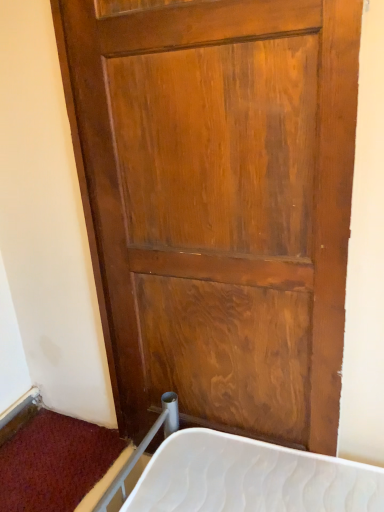
What is the approximate height of glossy wood door at center?

glossy wood door at center is 4.53 feet in height.

Describe the element at coordinates (218, 203) in the screenshot. The width and height of the screenshot is (384, 512). I see `glossy wood door at center` at that location.

Where is `glossy wood door at center`? The width and height of the screenshot is (384, 512). glossy wood door at center is located at coordinates (218, 203).

Where is `glossy wood door at center`? glossy wood door at center is located at coordinates (218, 203).